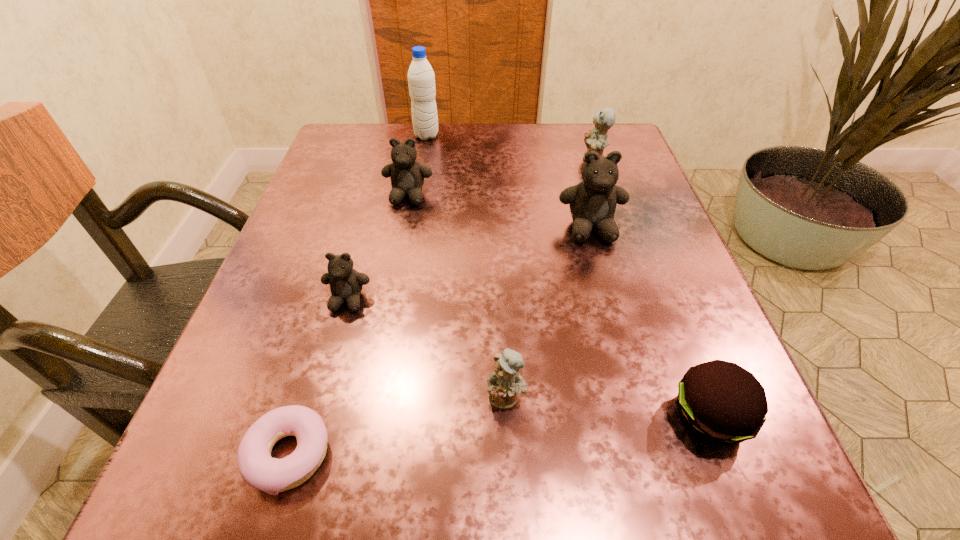
Identify the location of the left blue teddy bear. (505, 384).

This screenshot has width=960, height=540. I want to click on the third teddy bear from left to right, so click(x=505, y=384).

Identify the location of patty. (720, 402).

At what (x,y) coordinates should I click in order to perform the action: click on doughnut. Please return your answer as a coordinate pair (x, y). The height and width of the screenshot is (540, 960). Looking at the image, I should click on (258, 469).

Where is `pink doughnut`? pink doughnut is located at coordinates (258, 469).

This screenshot has height=540, width=960. In order to click on vacant area situated 0.100m on the front of the farthest object in this screenshot , I will do `click(421, 165)`.

Identify the location of free space located on the face of the tallest teddy bear. (647, 438).

The image size is (960, 540). In order to click on vacant space located 0.130m on the front-facing side of the seventh nearest object in this screenshot , I will do `click(523, 159)`.

You are a GUI agent. You are given a task and a screenshot of the screen. Output one action in this format:
    pyautogui.click(x=<x>, y=<y>)
    Task: Click on the free location located on the front-facing side of the seventh nearest object
    The width and height of the screenshot is (960, 540).
    Given the screenshot: What is the action you would take?
    pyautogui.click(x=447, y=159)

Where is `free space located 0.350m on the front-facing side of the seventh nearest object`? Image resolution: width=960 pixels, height=540 pixels. free space located 0.350m on the front-facing side of the seventh nearest object is located at coordinates (425, 159).